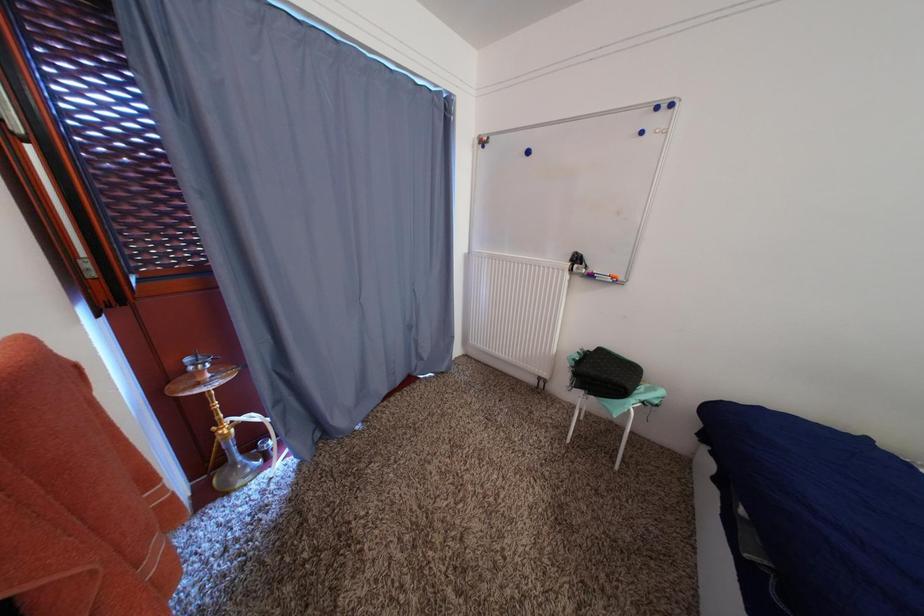
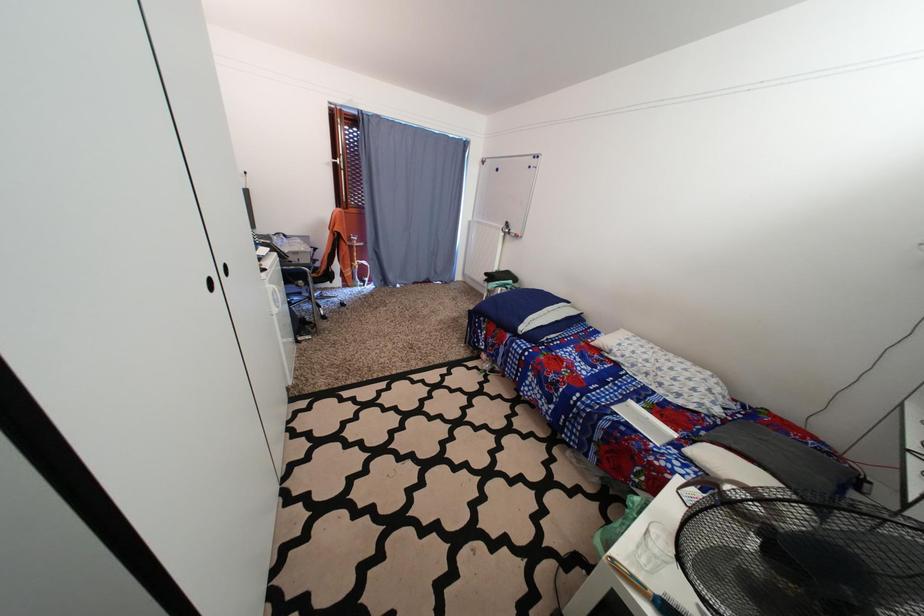
Which direction would the cameraman need to move to produce the second image?

The cameraman moved toward right, backward.